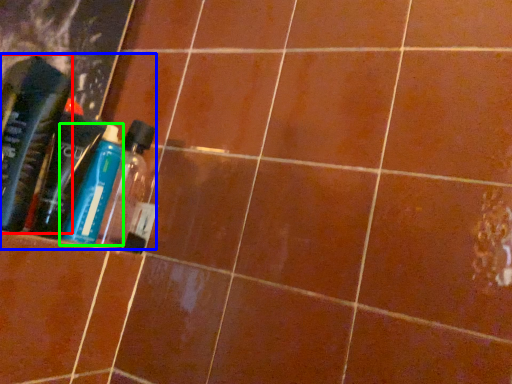
Question: Which object is positioned closest to bottle (highlighted by a red box)? Select from product (highlighted by a blue box) and bottle (highlighted by a green box).

Choices:
 (A) product
 (B) bottle

Answer: (A)